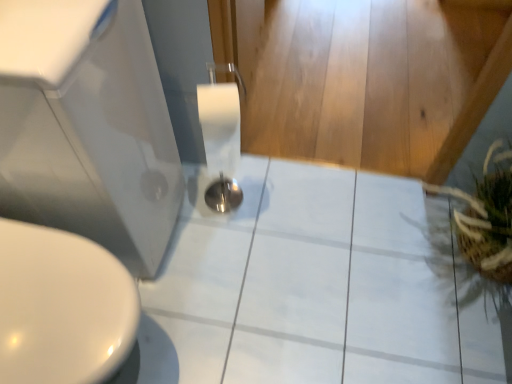
In order to face white glossy tile at center, should I rotate leftwards or rightwards?

A 9.930 degree turn to the right will do.

The image size is (512, 384). I want to click on brown woven basket at right, so click(x=486, y=218).

Image resolution: width=512 pixels, height=384 pixels. Find the location of `white glossy tile at center`. white glossy tile at center is located at coordinates (320, 288).

Is white glossy sink at lower left at the back of white glossy tile at center?

That's not correct — white glossy tile at center is not looking away from white glossy sink at lower left.

In the scene shown: Which object is more forward, white glossy tile at center or white glossy sink at lower left?

white glossy sink at lower left.

Does white glossy tile at center have a greater width compared to white glossy sink at lower left?

Yes.

How different are the orientations of white glossy tile at center and white glossy sink at lower left in degrees?

There is a 89.5-degree angle between the facing directions of white glossy tile at center and white glossy sink at lower left.

Does point (155, 212) appear closer or farther from the camera than point (252, 340)?

Point (155, 212).

From a real-world perspective, which object stands above the other?

In real-world perspective, white glossy sink at lower left is above.

In terms of size, does white glossy sink at lower left appear bigger or smaller than white glossy tile at center?

In the image, white glossy sink at lower left appears to be larger than white glossy tile at center.

Does white glossy sink at lower left have a greater width compared to white glossy tile at center?

No.

In order to click on plant that appears behind the white glossy sink at lower left in this screenshot , I will do pyautogui.click(x=486, y=218).

Is brown woven basket at right not inside white glossy sink at lower left?

Yes, brown woven basket at right is not within white glossy sink at lower left.

From the image's perspective, who appears lower, brown woven basket at right or white glossy sink at lower left?

brown woven basket at right.

Does brown woven basket at right lie in front of white glossy tile at center?

Yes, brown woven basket at right is closer to the camera.

Considering the relative positions of brown woven basket at right and white glossy tile at center in the image provided, is brown woven basket at right to the left of white glossy tile at center from the viewer's perspective?

No.

Is brown woven basket at right not near white glossy tile at center?

That's not correct — brown woven basket at right is a little close to white glossy tile at center.

Is white glossy sink at lower left in front of or behind brown woven basket at right in the image?

Clearly, white glossy sink at lower left is in front of brown woven basket at right.

From a real-world perspective, is white glossy sink at lower left positioned under brown woven basket at right based on gravity?

No, from a real-world perspective, white glossy sink at lower left is not beneath brown woven basket at right.

Is white glossy sink at lower left bigger or smaller than brown woven basket at right?

In the image, white glossy sink at lower left appears to be larger than brown woven basket at right.

Considering the relative sizes of white glossy tile at center and brown woven basket at right in the image provided, is white glossy tile at center taller than brown woven basket at right?

Result: No.

Image resolution: width=512 pixels, height=384 pixels. Identify the location of ceramic tile behind the brown woven basket at right. (320, 288).

From a real-world perspective, is white glossy tile at center on brown woven basket at right?

Actually, white glossy tile at center is physically below brown woven basket at right in the real world.

At what (x,y) coordinates should I click in order to perform the action: click on ceramic tile lying below the white glossy sink at lower left (from the image's perspective). Please return your answer as a coordinate pair (x, y). Looking at the image, I should click on (320, 288).

At what (x,y) coordinates should I click in order to perform the action: click on sink located on the left of white glossy tile at center. Please return your answer as a coordinate pair (x, y). This screenshot has height=384, width=512. Looking at the image, I should click on (87, 127).

Which object lies nearer to the anchor point brown woven basket at right, white glossy tile at center or white glossy sink at lower left?

white glossy tile at center lies closer to brown woven basket at right than the other object.

Looking at the image, which one is located further to white glossy sink at lower left, brown woven basket at right or white glossy tile at center?

brown woven basket at right lies further to white glossy sink at lower left than the other object.

When comparing their distances from white glossy sink at lower left, does white glossy tile at center or brown woven basket at right seem closer?

white glossy tile at center is closer to white glossy sink at lower left.

In the scene shown: From the image, which object appears to be farther from white glossy tile at center, brown woven basket at right or white glossy sink at lower left?

Among the two, white glossy sink at lower left is located further to white glossy tile at center.

Looking at the image, which one is located further to brown woven basket at right, white glossy sink at lower left or white glossy tile at center?

white glossy sink at lower left lies further to brown woven basket at right than the other object.

Which object lies nearer to the anchor point white glossy tile at center, white glossy sink at lower left or brown woven basket at right?

brown woven basket at right.

Where is `ceramic tile between white glossy sink at lower left and brown woven basket at right from left to right`? The image size is (512, 384). ceramic tile between white glossy sink at lower left and brown woven basket at right from left to right is located at coordinates (320, 288).